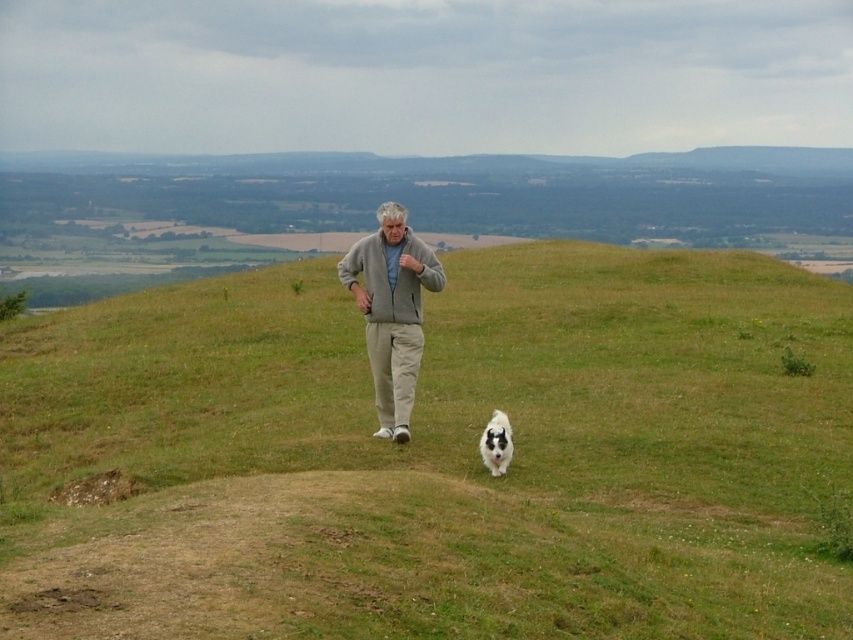
Question: Does green grassy hill at center appear under light gray zip-up sweater at center?

Choices:
 (A) no
 (B) yes

Answer: (A)

Question: Can you confirm if green grassy hill at center is positioned above light gray zip-up sweater at center?

Choices:
 (A) no
 (B) yes

Answer: (B)

Question: Is green grassy hill at center smaller than light gray zip-up sweater at center?

Choices:
 (A) yes
 (B) no

Answer: (B)

Question: Which object is positioned farthest from the green grassy hill at center?

Choices:
 (A) light gray zip-up sweater at center
 (B) white fluffy dog at lower center

Answer: (A)

Question: Among these points, which one is nearest to the camera?

Choices:
 (A) (403, 289)
 (B) (489, 461)

Answer: (B)

Question: Which object is positioned closest to the green grassy hill at center?

Choices:
 (A) white fluffy dog at lower center
 (B) light gray zip-up sweater at center

Answer: (A)